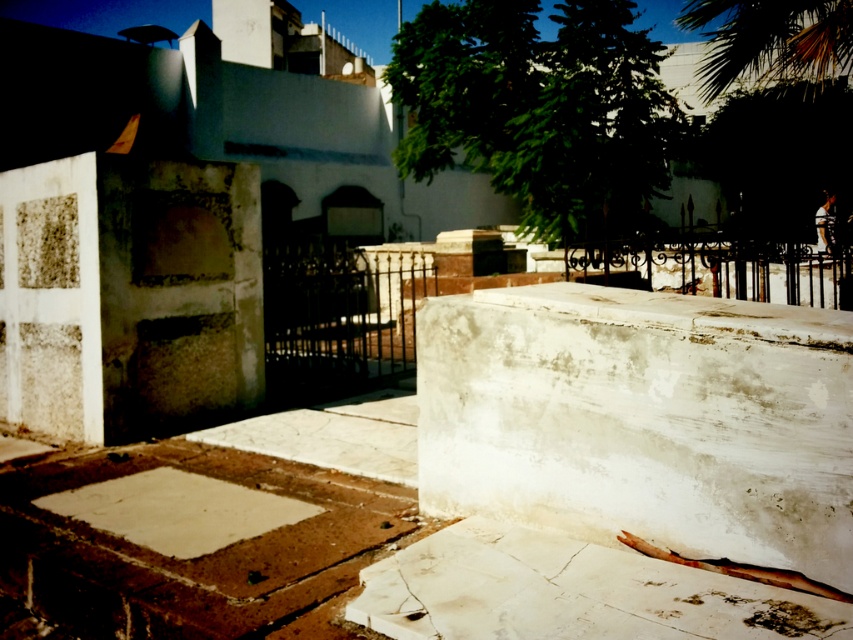
Question: Can you confirm if white marble block at center is thinner than green leafy palm tree at upper right?

Choices:
 (A) yes
 (B) no

Answer: (A)

Question: Which object appears closest to the camera in this image?

Choices:
 (A) green leafy palm tree at upper right
 (B) white marble slab at lower right
 (C) white marble block at center

Answer: (B)

Question: Considering the real-world distances, which object is farthest from the white marble slab at lower right?

Choices:
 (A) white marble block at center
 (B) green leafy palm tree at upper right

Answer: (B)

Question: Is white marble block at center positioned in front of green leafy palm tree at upper right?

Choices:
 (A) no
 (B) yes

Answer: (B)

Question: Is white marble block at center positioned at the back of green leafy palm tree at upper right?

Choices:
 (A) no
 (B) yes

Answer: (A)

Question: Among these points, which one is nearest to the camera?

Choices:
 (A) (605, 632)
 (B) (666, 388)
 (C) (752, 4)

Answer: (A)